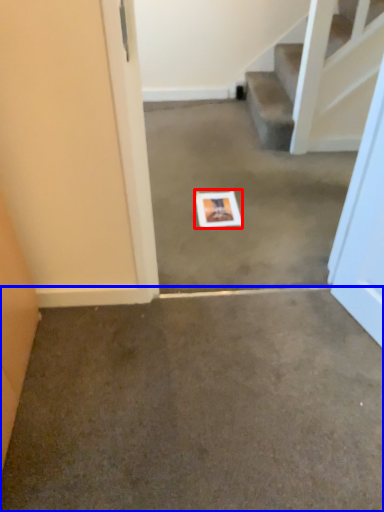
Question: Which object is further to the camera taking this photo, postcard (highlighted by a red box) or concrete (highlighted by a blue box)?

Choices:
 (A) postcard
 (B) concrete

Answer: (A)